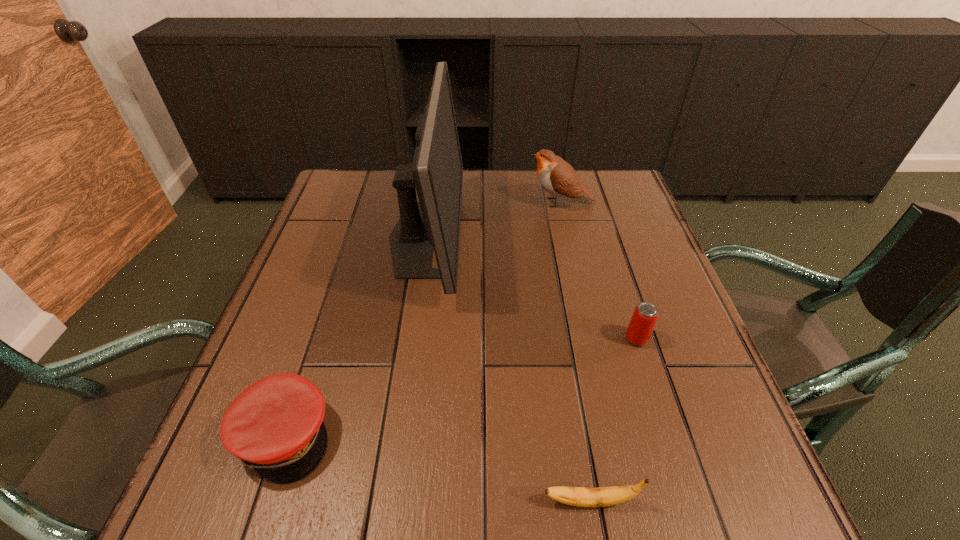
The height and width of the screenshot is (540, 960). Identify the location of object at the left edge. (275, 426).

Where is `bird situated at the right edge`? Image resolution: width=960 pixels, height=540 pixels. bird situated at the right edge is located at coordinates (555, 175).

I want to click on beer can located in the right edge section of the desktop, so [x=644, y=318].

The image size is (960, 540). Identify the location of object that is positioned at the near left corner. (275, 426).

You are a GUI agent. You are given a task and a screenshot of the screen. Output one action in this format:
    pyautogui.click(x=<x>, y=<y>)
    Task: Click on the object located in the far right corner section of the desktop
    This screenshot has width=960, height=540.
    Given the screenshot: What is the action you would take?
    pyautogui.click(x=555, y=175)

At what (x,y) coordinates should I click in order to perform the action: click on vacant space at the far edge. Please return your answer as a coordinate pair (x, y). Image resolution: width=960 pixels, height=540 pixels. Looking at the image, I should click on (516, 170).

This screenshot has width=960, height=540. What are the coordinates of `free spot at the left edge of the desktop` in the screenshot? It's located at (290, 326).

I want to click on vacant space at the right edge of the desktop, so click(x=684, y=346).

You are a GUI agent. You are given a task and a screenshot of the screen. Output one action in this format:
    pyautogui.click(x=<x>, y=<y>)
    Task: Click on the vacant region at the far left corner of the desktop
    The width and height of the screenshot is (960, 540).
    Given the screenshot: What is the action you would take?
    pyautogui.click(x=372, y=174)

Find the location of a particular element. vacant space at the near left corner is located at coordinates (275, 490).